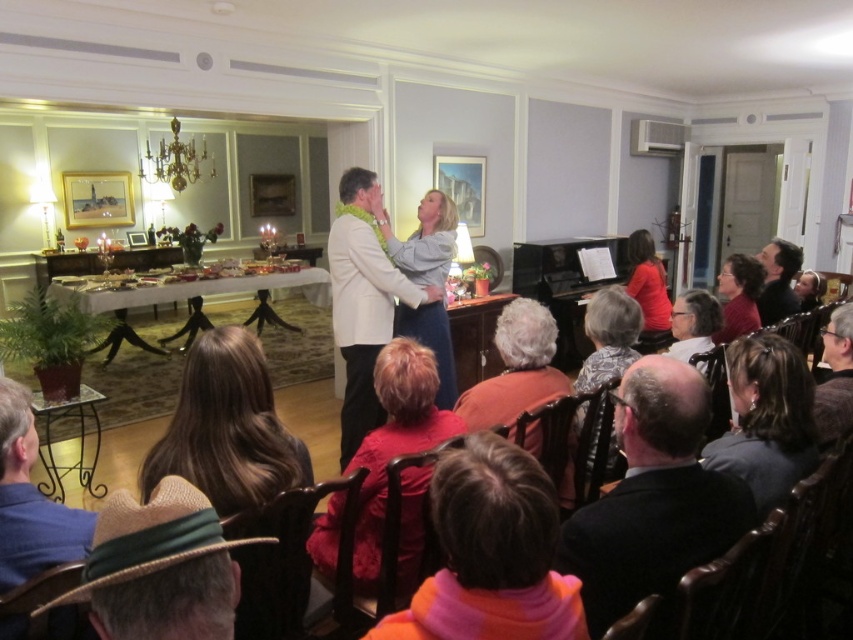
You are a guest at this event and need to choose between the orange fabric chair at center and the dark brown leather chair at right. Which chair is smaller in size?

The orange fabric chair at center has a smaller size compared to the dark brown leather chair at right, so the orange fabric chair at center is the smaller one.

You are standing at the entrance of the room and want to greet the person with gray hair at center. Which direction should you move relative to the orange fabric chair at center?

The orange fabric chair at center is to the left of gray hair at center, so you should move to the right of the orange fabric chair at center to reach the gray hair at center.

You are a photographer at the event and want to capture a closeup of the dark brown hair at center and denim jacket at center. Which object should you zoom in on first to ensure it appears larger in the photo?

The denim jacket at center should be zoomed in on first because it is wider than the dark brown hair at center, making it easier to focus on and appear larger in the photo.